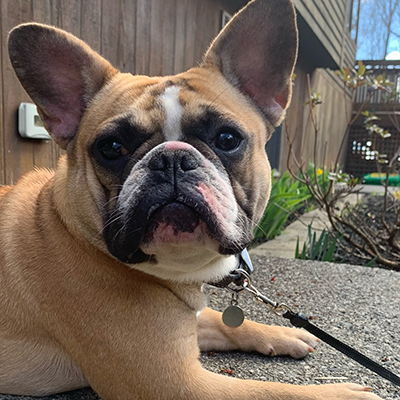
You are a GUI agent. You are given a task and a screenshot of the screen. Output one action in this format:
    pyautogui.click(x=<x>, y=<y>)
    Task: Click on the right front leg
    
    Given the screenshot: What is the action you would take?
    pyautogui.click(x=241, y=390)